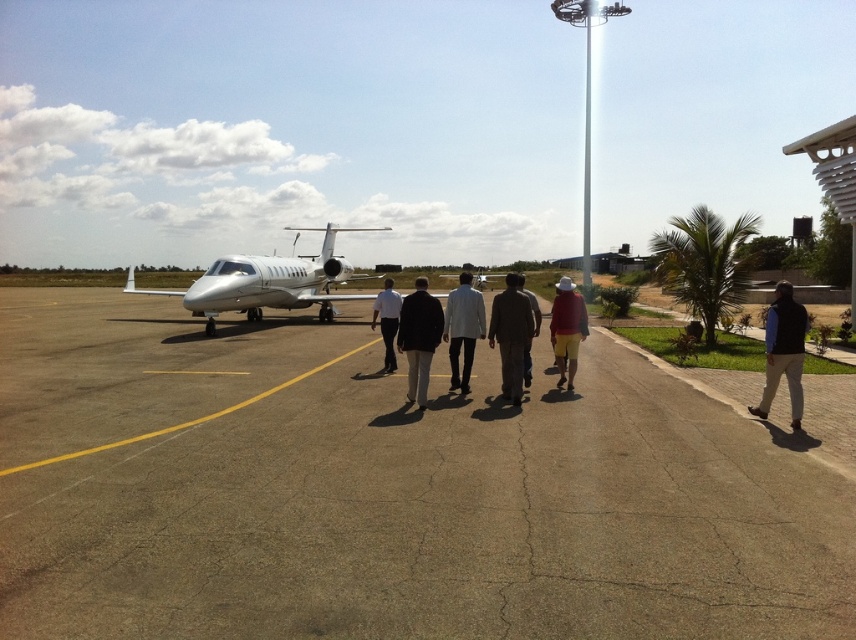
Question: Can you confirm if dark blue vest at center is positioned to the left of white matte shirt at center?

Choices:
 (A) no
 (B) yes

Answer: (A)

Question: Which is nearer to the white matte shirt at center?

Choices:
 (A) dark blue vest at center
 (B) concrete tarmac at center
 (C) white glossy airplane at center
 (D) reddish-brown shorts at center

Answer: (B)

Question: Estimate the real-world distances between objects in this image. Which object is closer to the reddish-brown shorts at center?

Choices:
 (A) light beige fabric jacket at center
 (B) dark brown leather jacket at center
 (C) white matte shirt at center

Answer: (B)

Question: Can you confirm if concrete tarmac at center is positioned below light beige fabric jacket at center?

Choices:
 (A) no
 (B) yes

Answer: (B)

Question: Which of these objects is positioned farthest from the light beige fabric jacket at center?

Choices:
 (A) dark brown leather jacket at center
 (B) white matte shirt at center

Answer: (B)

Question: Is dark blue vest at center positioned behind light beige fabric jacket at center?

Choices:
 (A) no
 (B) yes

Answer: (A)